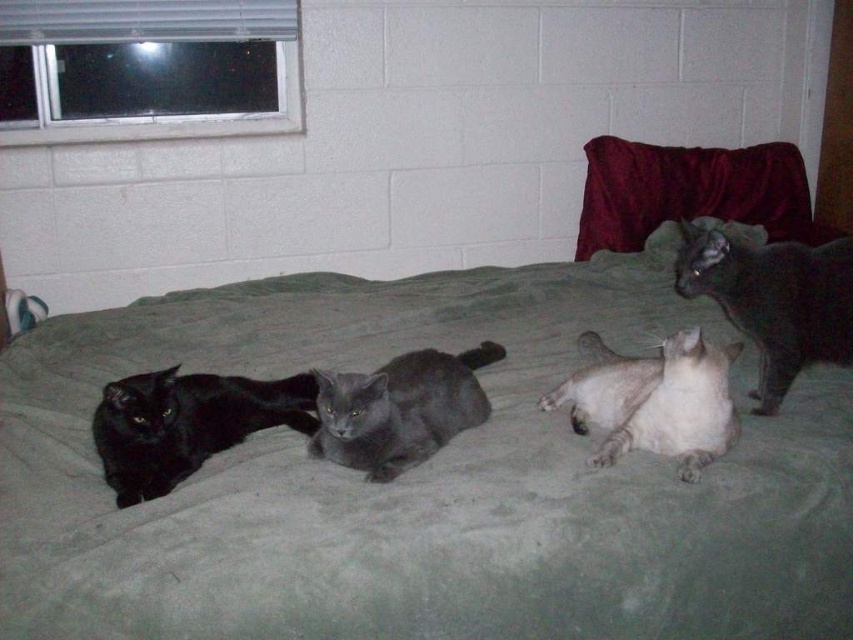
You are a cat owner who wants to ensure all your cats have enough space on the bed. Given that the matte black cat at left is smaller than the satin gray cat at center, which cat requires more space on the bed?

The satin gray cat at center requires more space on the bed since it is larger than the matte black cat at left.

Looking at this image, you are standing in the bedroom looking at the bed. There are two points marked on the bed, one at coordinates point [180,467] and the other at point [670,436]. Which point is closer to you?

Point [180,467] is closer to the viewer than point [670,436].